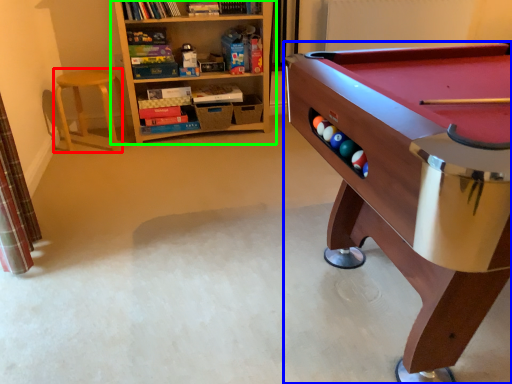
Question: Which is farther away from stool (highlighted by a red box)? table (highlighted by a blue box) or bookcase (highlighted by a green box)?

Choices:
 (A) table
 (B) bookcase

Answer: (A)